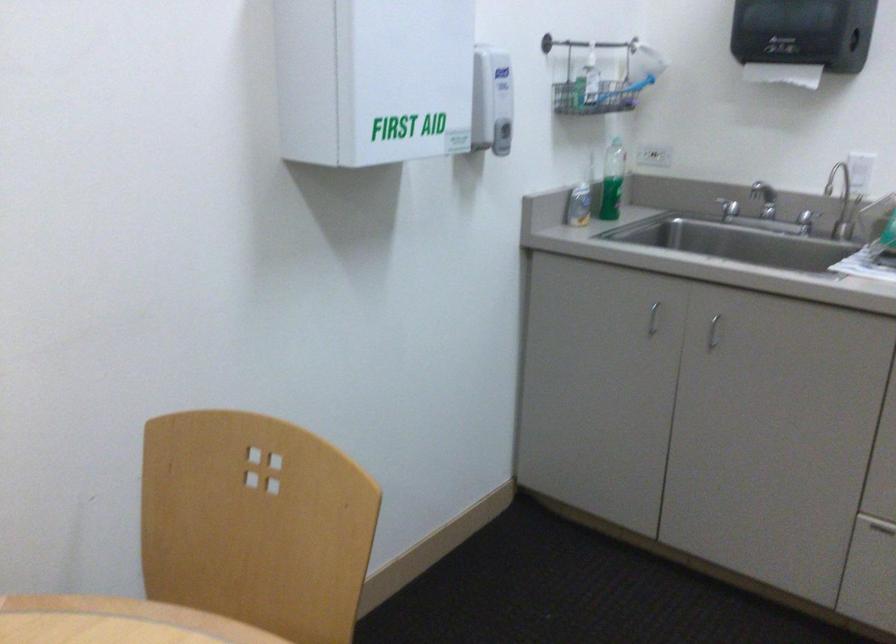
Where is `sanitizer dispenser lever`? sanitizer dispenser lever is located at coordinates click(492, 100).